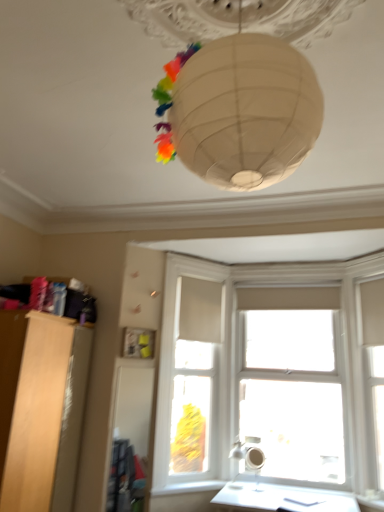
Question: Can you confirm if transparent glass window at center is shorter than white smooth window sill at lower center?

Choices:
 (A) no
 (B) yes

Answer: (A)

Question: Can you confirm if transparent glass window at center is wider than white smooth window sill at lower center?

Choices:
 (A) no
 (B) yes

Answer: (B)

Question: Is transparent glass window at center turned away from white smooth window sill at lower center?

Choices:
 (A) yes
 (B) no

Answer: (B)

Question: Is transparent glass window at center positioned far away from white smooth window sill at lower center?

Choices:
 (A) no
 (B) yes

Answer: (B)

Question: Is transparent glass window at center positioned behind white smooth window sill at lower center?

Choices:
 (A) no
 (B) yes

Answer: (B)

Question: Considering the positions of white matte window frame at right, the 2th window frame from the left, and light wood cabinet at left in the image, is white matte window frame at right, the 2th window frame from the left, wider or thinner than light wood cabinet at left?

Choices:
 (A) wide
 (B) thin

Answer: (B)

Question: Considering the positions of point (357, 303) and point (6, 359), is point (357, 303) closer or farther from the camera than point (6, 359)?

Choices:
 (A) farther
 (B) closer

Answer: (A)

Question: From a real-world perspective, is white matte window frame at right, which is the 1th window frame in right-to-left order, positioned above or below light wood cabinet at left?

Choices:
 (A) above
 (B) below

Answer: (A)

Question: Would you say white matte window frame at right, which is the 1th window frame in right-to-left order, is inside or outside light wood cabinet at left?

Choices:
 (A) outside
 (B) inside

Answer: (A)

Question: Would you say transparent glass window at center is inside or outside light wood cabinet at left?

Choices:
 (A) inside
 (B) outside

Answer: (B)

Question: In terms of height, does transparent glass window at center look taller or shorter compared to light wood cabinet at left?

Choices:
 (A) tall
 (B) short

Answer: (A)

Question: Looking at the image, does transparent glass window at center seem bigger or smaller compared to light wood cabinet at left?

Choices:
 (A) big
 (B) small

Answer: (B)

Question: Is transparent glass window at center to the left or to the right of light wood cabinet at left in the image?

Choices:
 (A) right
 (B) left

Answer: (A)

Question: From a real-world perspective, is transparent glass window at center above or below white matte window frame at right, the 2th window frame from the left?

Choices:
 (A) below
 (B) above

Answer: (A)

Question: Considering their positions, is transparent glass window at center located in front of or behind white matte window frame at right, the 2th window frame from the left?

Choices:
 (A) front
 (B) behind

Answer: (B)